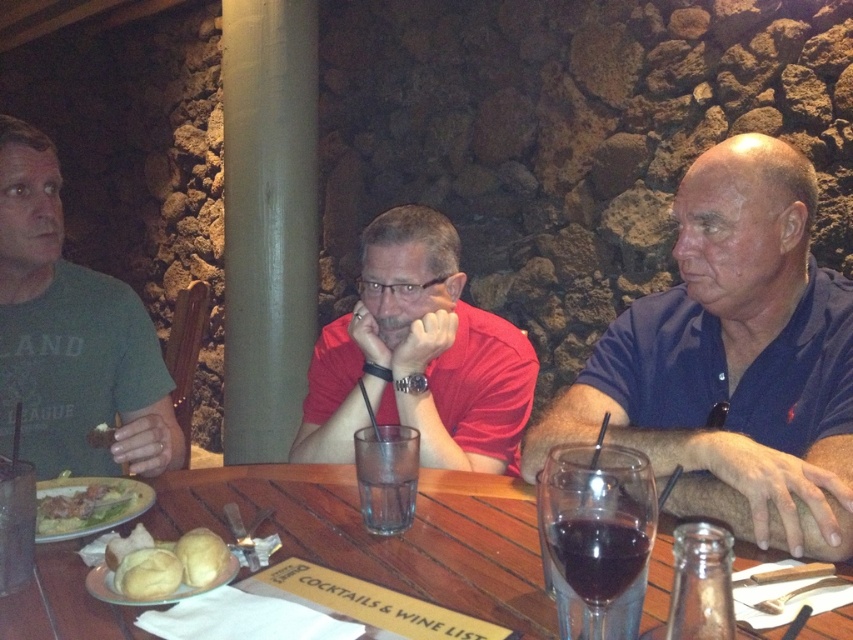
You are a photographer taking a picture of the dining table. You have two points marked on your viewfinder at coordinates point (x=532, y=468) and point (x=173, y=547). Which point is closer to the camera?

Point (x=532, y=468) is further to the camera than point (x=173, y=547), so the point closer to the camera is point (x=173, y=547).

You are a server in a rustic restaurant and you need to place a new menu on the table. The menu is 10 cm tall. The table has a dark blue polo shirt at right and a golden bread roll at center. Which object is taller so you can place the menu next to it without blocking the view?

The dark blue polo shirt at right is much taller than the golden bread roll at center, so you should place the menu next to the dark blue polo shirt at right to avoid blocking the view.

You are a waiter holding a tray with a dessert that needs to be placed between the matte red shirt at center and the golden crispy bread at center. The dessert requires a minimum of 20 inches of space to be safely placed. Can you place the dessert between them?

The distance between the matte red shirt at center and the golden crispy bread at center is 20.97 inches, which is just enough to accommodate the dessert requiring a minimum of 20 inches of space. Yes, you can place the dessert between them.